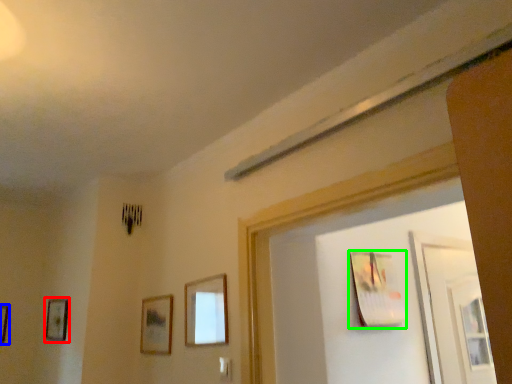
Question: Estimate the real-world distances between objects in this image. Which object is farther from picture frame (highlighted by a red box), picture frame (highlighted by a blue box) or picture frame (highlighted by a green box)?

Choices:
 (A) picture frame
 (B) picture frame

Answer: (B)